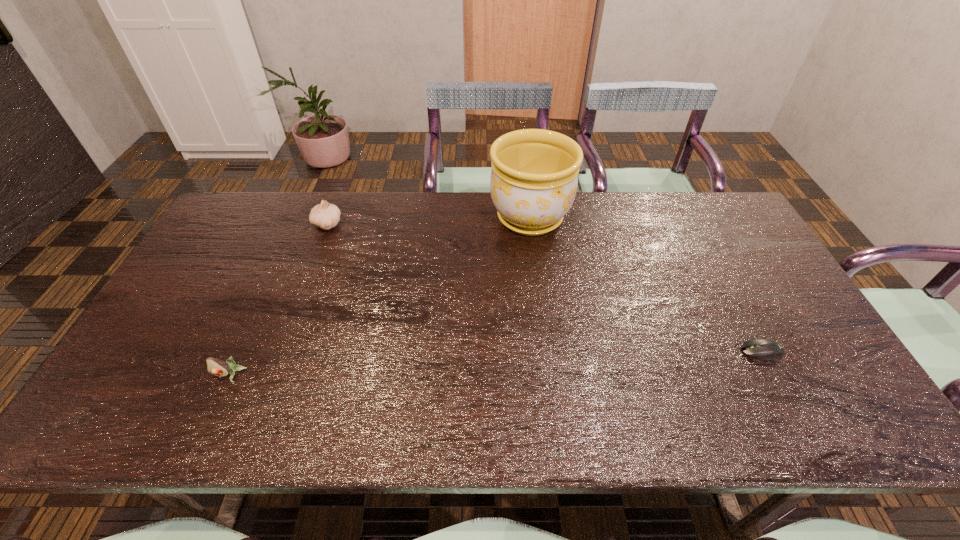
Find the location of a particular element. This screenshot has width=960, height=540. vacant area that lies between the garlic and the avocado is located at coordinates (278, 300).

At what (x,y) coordinates should I click in order to perform the action: click on object that can be found as the second closest to the third tallest object. Please return your answer as a coordinate pair (x, y). Looking at the image, I should click on (534, 177).

Where is `object identified as the third closest to the nearest object`? Image resolution: width=960 pixels, height=540 pixels. object identified as the third closest to the nearest object is located at coordinates (764, 349).

Where is `blank area in the image that satisfies the following two spatial constraints: 1. on the wheel side of the third farthest object; 2. on the seed side of the avocado`? This screenshot has height=540, width=960. blank area in the image that satisfies the following two spatial constraints: 1. on the wheel side of the third farthest object; 2. on the seed side of the avocado is located at coordinates (774, 375).